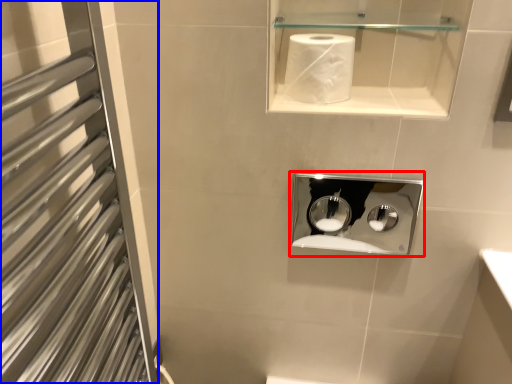
Question: Which of the following is the closest to the observer, medicine cabinet (highlighted by a red box) or screen door (highlighted by a blue box)?

Choices:
 (A) medicine cabinet
 (B) screen door

Answer: (B)